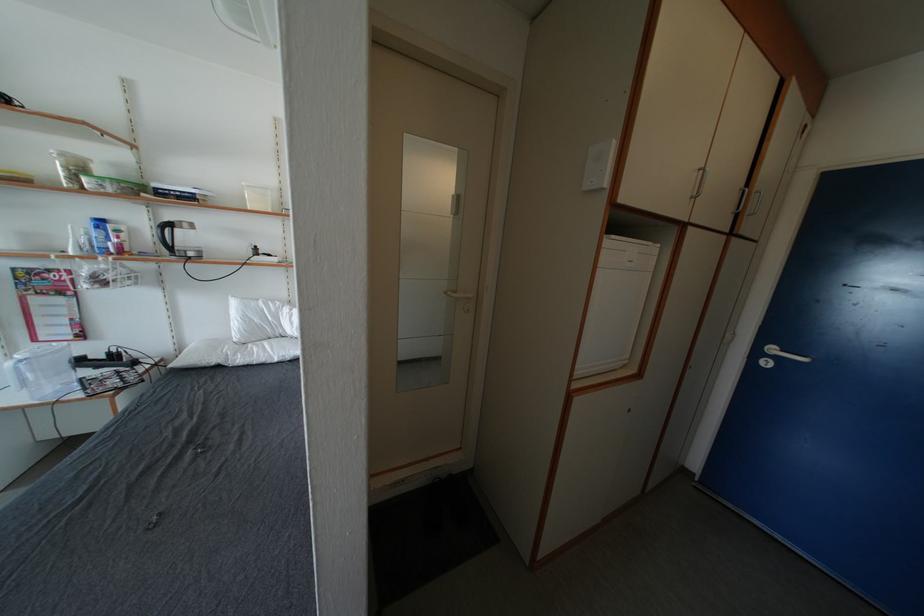
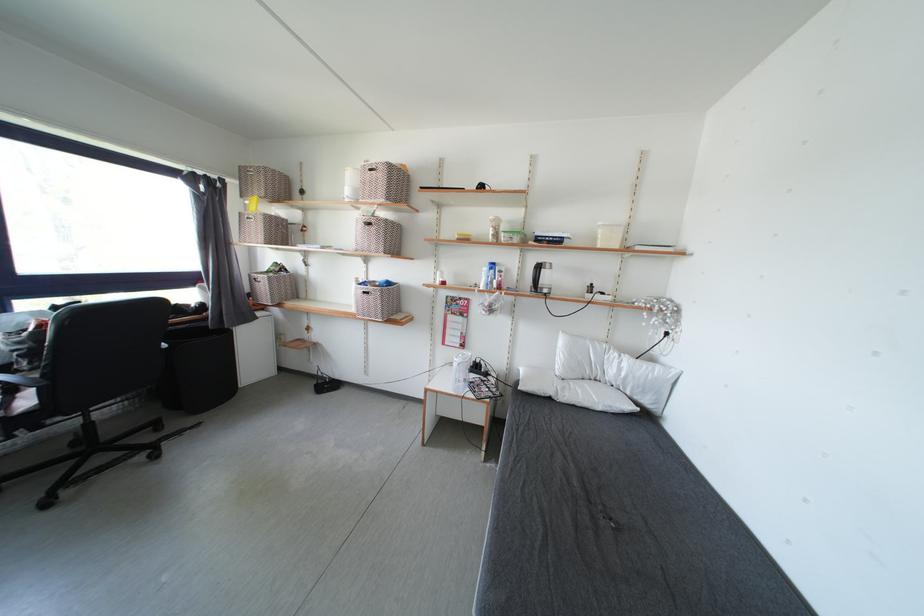
The point at (x=225, y=371) is marked in the first image. Where is the corresponding point in the second image?

(556, 403)